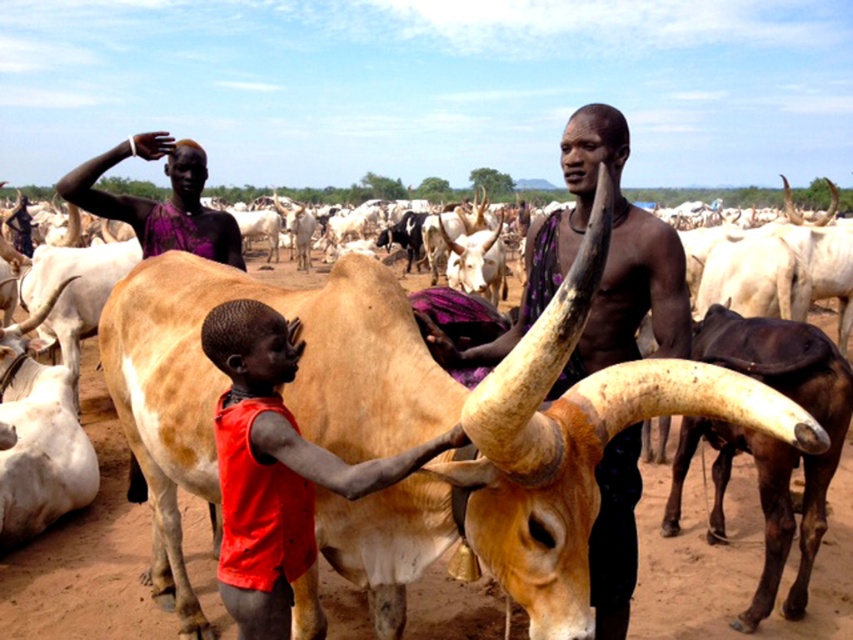
Consider the image. Between red sleeveless shirt at center and purple fabric at upper center, which one has more height?

Standing taller between the two is red sleeveless shirt at center.

The image size is (853, 640). What do you see at coordinates (276, 467) in the screenshot? I see `red sleeveless shirt at center` at bounding box center [276, 467].

Locate an element on the screen. red sleeveless shirt at center is located at coordinates (276, 467).

Who is higher up, matte purple shirt at center or purple fabric at upper center?

purple fabric at upper center is higher up.

Is matte purple shirt at center wider than purple fabric at upper center?

Indeed, matte purple shirt at center has a greater width compared to purple fabric at upper center.

Where is `matte purple shirt at center`? matte purple shirt at center is located at coordinates coord(604,268).

The image size is (853, 640). Find the location of `matte purple shirt at center`. matte purple shirt at center is located at coordinates (604, 268).

Who is lower down, matte purple shirt at center or red sleeveless shirt at center?

red sleeveless shirt at center

Can you confirm if matte purple shirt at center is thinner than red sleeveless shirt at center?

No, matte purple shirt at center is not thinner than red sleeveless shirt at center.

Does point (601, 488) come farther from viewer compared to point (251, 323)?

Yes, point (601, 488) is farther from viewer.

Locate an element on the screen. matte purple shirt at center is located at coordinates (604, 268).